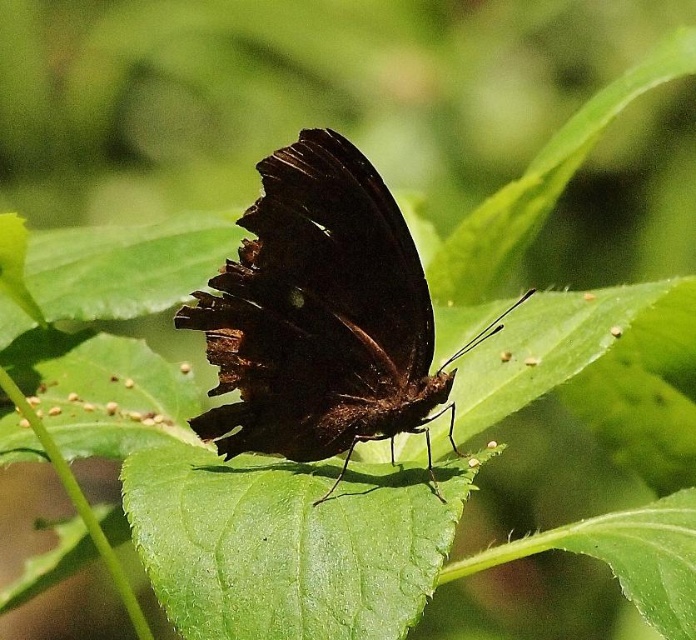
You are an entomologist observing the scene. You need to determine which object occupies more space in the image between the shiny brown butterfly at center and the green glossy leaf at center. Which one is bigger?

The shiny brown butterfly at center is larger in size than the green glossy leaf at center, so the shiny brown butterfly at center occupies more space in the image.